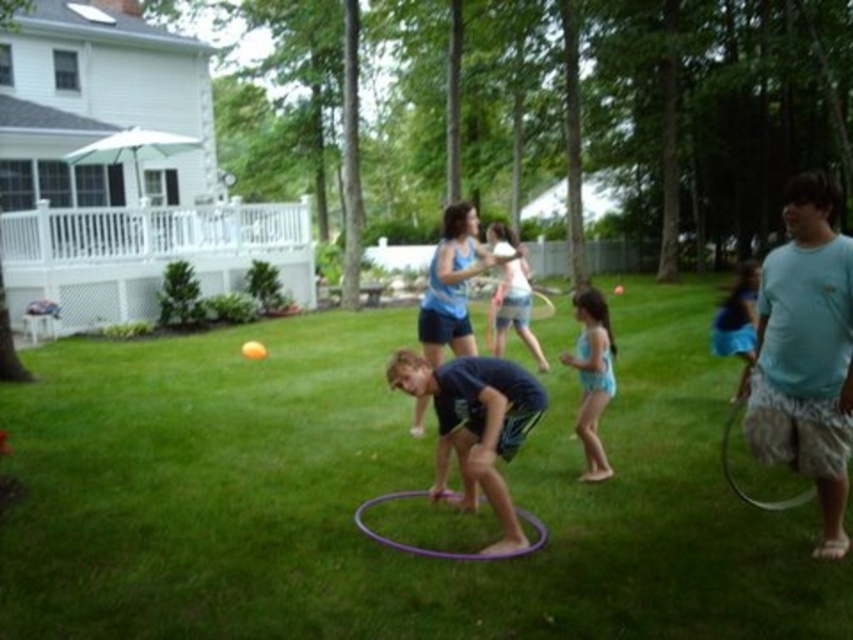
Question: Which object is positioned farthest from the green grass at center?

Choices:
 (A) dark blue fabric at center
 (B) blue fabric dress at lower right

Answer: (B)

Question: Which point is farther from the camera taking this photo?

Choices:
 (A) (463, 381)
 (B) (792, 403)

Answer: (A)

Question: Which point is farther to the camera?

Choices:
 (A) blue fabric dress at lower right
 (B) light blue t-shirt at center
 (C) dark blue fabric at center
 (D) green grass at center

Answer: (A)

Question: Does light blue t-shirt at center have a smaller size compared to purple plastic hula hoop at right?

Choices:
 (A) yes
 (B) no

Answer: (A)

Question: Considering the relative positions of light blue t-shirt at center and purple plastic hula hoop at right in the image provided, where is light blue t-shirt at center located with respect to purple plastic hula hoop at right?

Choices:
 (A) right
 (B) left

Answer: (B)

Question: Is dark blue fabric at center positioned before blue fabric swimsuit at center?

Choices:
 (A) yes
 (B) no

Answer: (A)